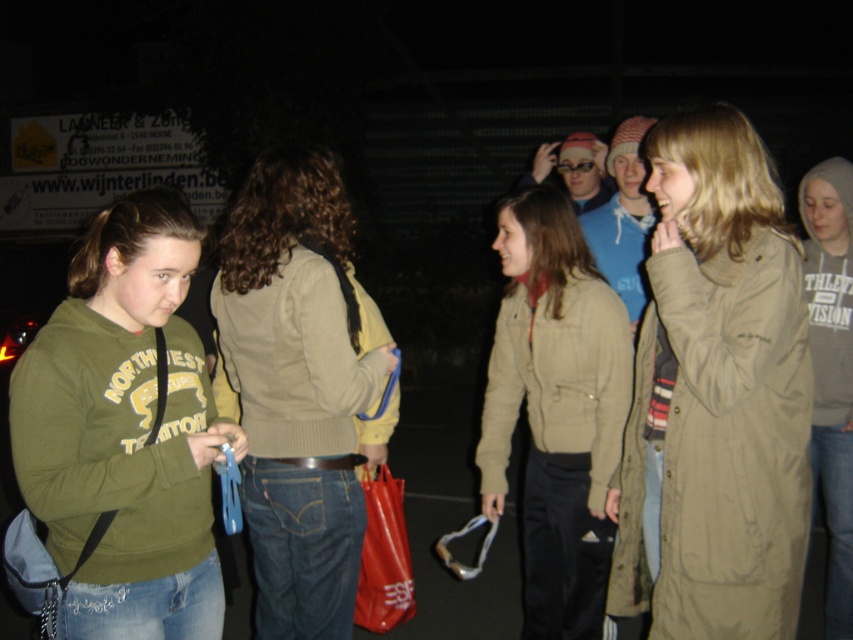
Is olive green parka at center shorter than matte khaki jacket at center?

Indeed, olive green parka at center has a lesser height compared to matte khaki jacket at center.

Between olive green parka at center and matte khaki jacket at center, which one is positioned higher?

olive green parka at center

Find the location of a particular element. The width and height of the screenshot is (853, 640). olive green parka at center is located at coordinates (715, 397).

Between olive green parka at center and beige knitted sweater at center, which one appears on the left side from the viewer's perspective?

beige knitted sweater at center is more to the left.

Can you confirm if olive green parka at center is positioned below beige knitted sweater at center?

No.

What are the coordinates of `olive green parka at center` in the screenshot? It's located at (715, 397).

Locate an element on the screen. olive green parka at center is located at coordinates (715, 397).

Can you confirm if olive green parka at center is thinner than beige sweater at center?

Correct, olive green parka at center's width is less than beige sweater at center's.

Who is higher up, olive green parka at center or beige sweater at center?

olive green parka at center is above.

Who is more forward, (651, 396) or (305, 225)?

Point (651, 396) is in front.

You are a GUI agent. You are given a task and a screenshot of the screen. Output one action in this format:
    pyautogui.click(x=<x>, y=<y>)
    Task: Click on the olive green parka at center
    
    Given the screenshot: What is the action you would take?
    [x=715, y=397]